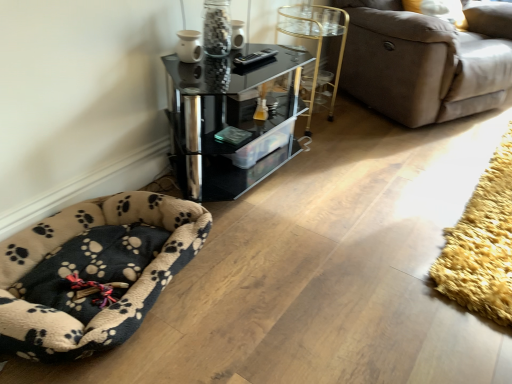
This screenshot has width=512, height=384. I want to click on free region on the left part of yellow shaggy rug at lower right, so click(x=373, y=196).